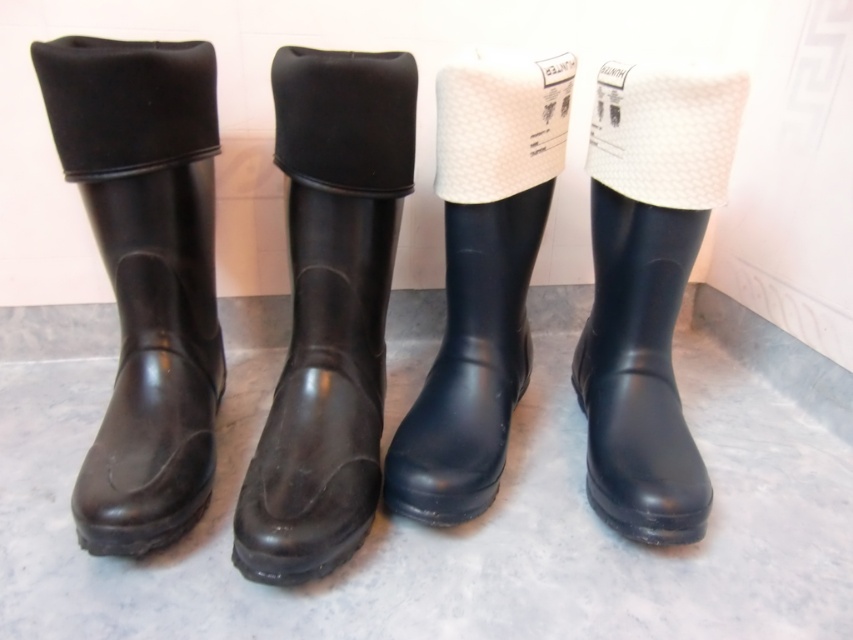
You are trying to decide between two pairs of boots displayed in the store. The black rubber boot at center and the navy rubber boot at center are both in your size. However, you prefer a wider fit. Which pair should you choose?

The navy rubber boot at center has a greater width compared to the black rubber boot at center, so you should choose the navy rubber boot at center for a wider fit.

You are standing at the entrance of the room where the four pairs of rubber boots are lined up. You need to place a new boot mat exactly halfway between the black rubber boot at left and the fourth pair of boots. Where should you place the mat?

The black rubber boot at left is located at point (x=144, y=275). To determine the halfway point between it and the fourth pair, you would need the coordinates of the fourth pair. Since the coordinates of the fourth pair are not provided, the exact placement cannot be calculated. However, if the fourth pair were at a known coordinate, the midpoint would be the average of the x and y coordinates of both points.

You are standing in front of a row of rubber boots. You see a black rubber boot at center and a navy rubber boot at center. Which one is positioned to the left?

The black rubber boot at center is positioned to the left of the navy rubber boot at center.